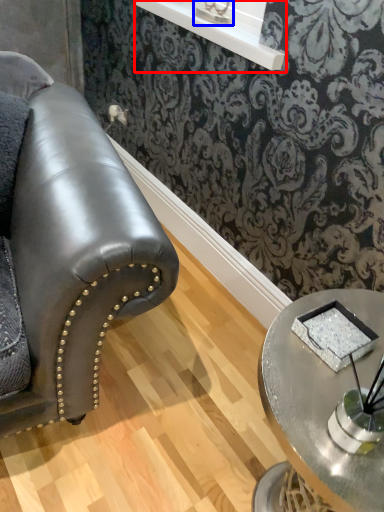
Question: Among these objects, which one is farthest to the camera, window sill (highlighted by a red box) or table lamp (highlighted by a blue box)?

Choices:
 (A) window sill
 (B) table lamp

Answer: (B)